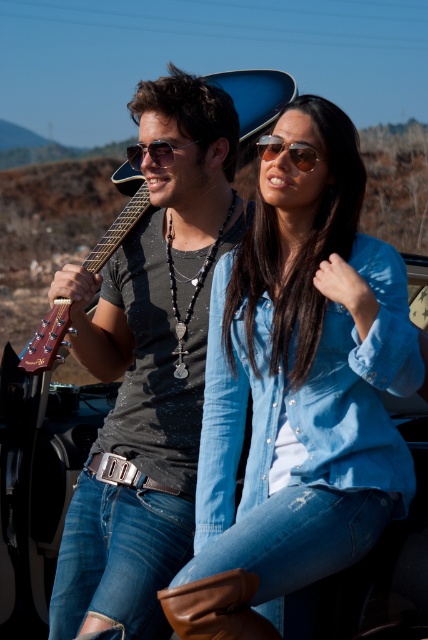
Question: Which object is positioned farthest from the matte black shirt at center?

Choices:
 (A) sunglasses at center
 (B) denim shirt at center
 (C) matte black sunglasses at center
 (D) wooden acoustic guitar at left

Answer: (D)

Question: Can you confirm if denim shirt at center is positioned to the left of sunglasses at center?

Choices:
 (A) yes
 (B) no

Answer: (B)

Question: Which of these objects is positioned farthest from the matte black sunglasses at center?

Choices:
 (A) wooden acoustic guitar at left
 (B) matte black shirt at center
 (C) sunglasses at center
 (D) denim shirt at center

Answer: (B)

Question: Which object is the farthest from the sunglasses at center?

Choices:
 (A) wooden acoustic guitar at left
 (B) denim shirt at center

Answer: (B)

Question: Is wooden acoustic guitar at left to the left of matte black sunglasses at center from the viewer's perspective?

Choices:
 (A) no
 (B) yes

Answer: (B)

Question: Can you confirm if denim shirt at center is positioned to the left of sunglasses at center?

Choices:
 (A) yes
 (B) no

Answer: (B)